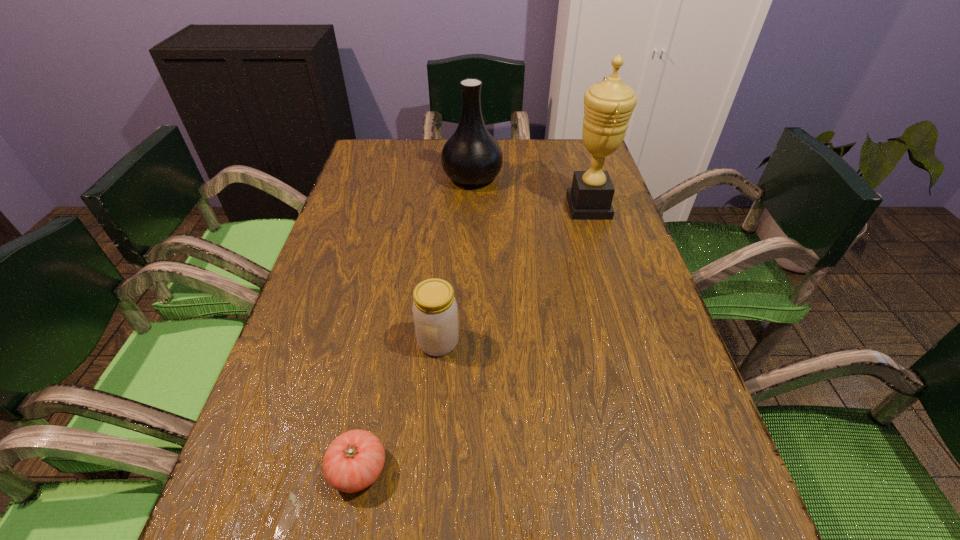
At what (x,y) coordinates should I click in order to perform the action: click on free space between the second tallest object and the trophy cup. Please return your answer as a coordinate pair (x, y). Looking at the image, I should click on (531, 192).

Where is `free space between the third farthest object and the tomato`? free space between the third farthest object and the tomato is located at coordinates (398, 406).

Locate an element on the screen. The height and width of the screenshot is (540, 960). vacant space that's between the tallest object and the third shortest object is located at coordinates (531, 192).

Identify the location of blank region between the third tallest object and the trophy cup. (514, 274).

Image resolution: width=960 pixels, height=540 pixels. Find the location of `unoccupied position between the second tallest object and the jar`. unoccupied position between the second tallest object and the jar is located at coordinates (455, 260).

Find the location of a particular element. free space that is in between the third shortest object and the tallest object is located at coordinates (531, 192).

You are a GUI agent. You are given a task and a screenshot of the screen. Output one action in this format:
    pyautogui.click(x=<x>, y=<y>)
    Task: Click on the free spot between the shortest object and the rightmost object
    The width and height of the screenshot is (960, 540).
    Given the screenshot: What is the action you would take?
    pyautogui.click(x=473, y=338)

Find the location of a particular element. vacant area between the third farthest object and the nearest object is located at coordinates click(398, 406).

Where is `object that is the closest to the second shortest object`? object that is the closest to the second shortest object is located at coordinates (353, 461).

Choose which object is the nearest neighbor to the second tallest object. Please provide its 2D coordinates. Your answer should be formatted as a tuple, i.e. [(x, y)], where the tuple contains the x and y coordinates of a point satisfying the conditions above.

[(608, 105)]